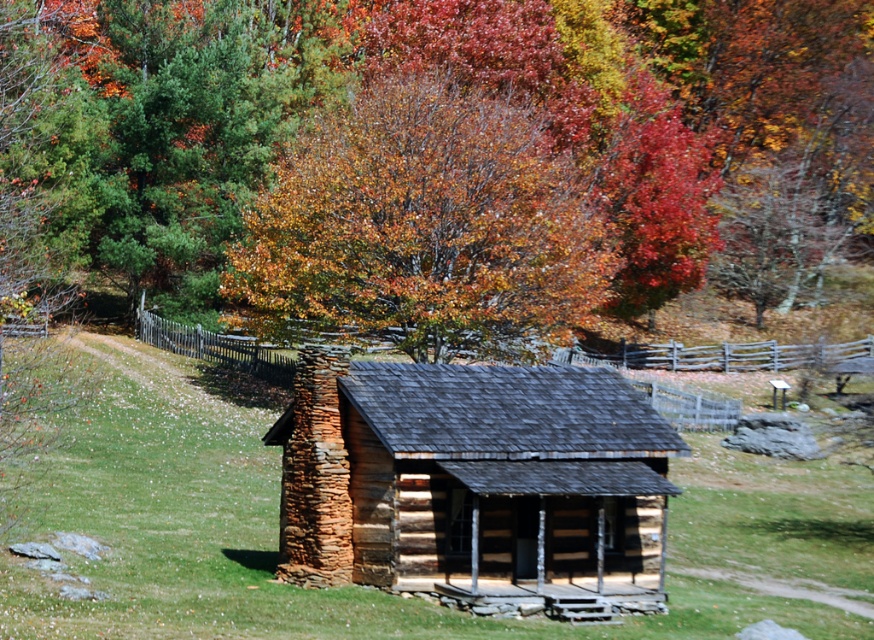
You are standing at the entrance of the rustic log cabin and want to place a small garden statue exactly at the center of the green grass at center. According to the image, what are the coordinates where you should place the statue?

The coordinates for the green grass at center are point (364, 586), so you should place the statue there.

You are standing in front of the wooden log cabin at center and looking towards the autumn leaves at upper center. Which object is closer to you?

The wooden log cabin at center is closer to you since it is in front of the autumn leaves at upper center.

You are a gardener standing on the green grass at center. You want to water the wooden log cabin at center using a hose that can reach 5 meters. Can you water the cabin without moving the hose? Please explain your reasoning.

The distance between the green grass at center and the wooden log cabin at center is 4.67 meters. Since the hose can reach 5 meters, which is longer than the distance, you can water the cabin without moving the hose.